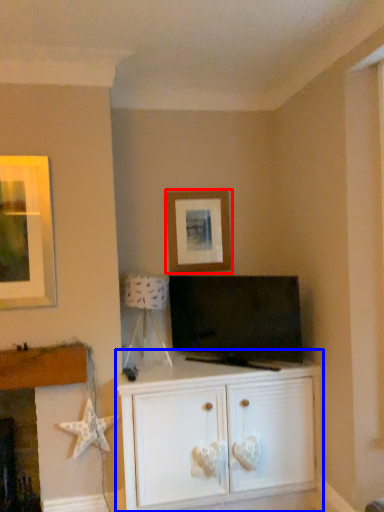
Question: Which of the following is the closest to the observer, picture frame (highlighted by a red box) or cabinetry (highlighted by a blue box)?

Choices:
 (A) picture frame
 (B) cabinetry

Answer: (B)